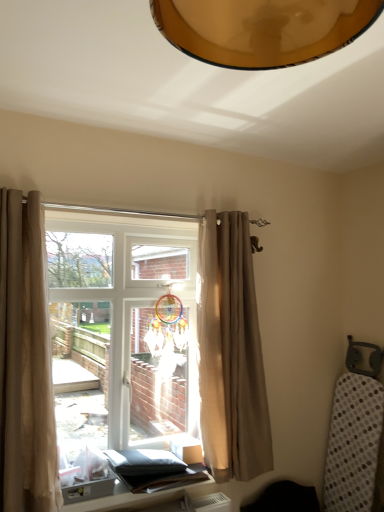
Question: From the image's perspective, would you say matte black table at lower center is positioned over beige fabric curtain at left, the 1th curtain positioned from the left?

Choices:
 (A) yes
 (B) no

Answer: (B)

Question: Considering the relative positions of matte black table at lower center and beige fabric curtain at left, the 1th curtain positioned from the left, in the image provided, is matte black table at lower center to the right of beige fabric curtain at left, the 1th curtain positioned from the left, from the viewer's perspective?

Choices:
 (A) yes
 (B) no

Answer: (A)

Question: From a real-world perspective, is matte black table at lower center positioned over beige fabric curtain at left, the 2th curtain from the back, based on gravity?

Choices:
 (A) no
 (B) yes

Answer: (A)

Question: From a real-world perspective, is matte black table at lower center located beneath beige fabric curtain at left, the first curtain from the front?

Choices:
 (A) no
 (B) yes

Answer: (B)

Question: Are matte black table at lower center and beige fabric curtain at left, the 2th curtain from the back, far apart?

Choices:
 (A) no
 (B) yes

Answer: (A)

Question: Can you confirm if matte black table at lower center is bigger than beige fabric curtain at left, which is the second curtain in right-to-left order?

Choices:
 (A) no
 (B) yes

Answer: (A)

Question: From a real-world perspective, is beige fabric curtain at center, which ranks as the 2th curtain in front-to-back order, physically below translucent glass window at center?

Choices:
 (A) no
 (B) yes

Answer: (A)

Question: Can you confirm if beige fabric curtain at center, which ranks as the first curtain in back-to-front order, is thinner than translucent glass window at center?

Choices:
 (A) yes
 (B) no

Answer: (A)

Question: Does beige fabric curtain at center, acting as the 2th curtain starting from the left, appear on the left side of translucent glass window at center?

Choices:
 (A) no
 (B) yes

Answer: (A)

Question: Are beige fabric curtain at center, which ranks as the first curtain in back-to-front order, and translucent glass window at center located far from each other?

Choices:
 (A) no
 (B) yes

Answer: (A)

Question: From a real-world perspective, is beige fabric curtain at center, acting as the 2th curtain starting from the left, on top of translucent glass window at center?

Choices:
 (A) no
 (B) yes

Answer: (B)

Question: Does beige fabric curtain at center, which appears as the 1th curtain when viewed from the right, have a greater width compared to translucent glass window at center?

Choices:
 (A) yes
 (B) no

Answer: (B)

Question: Would you consider beige fabric curtain at left, the 2th curtain from the back, to be distant from beige fabric curtain at center, which ranks as the first curtain in back-to-front order?

Choices:
 (A) yes
 (B) no

Answer: (B)